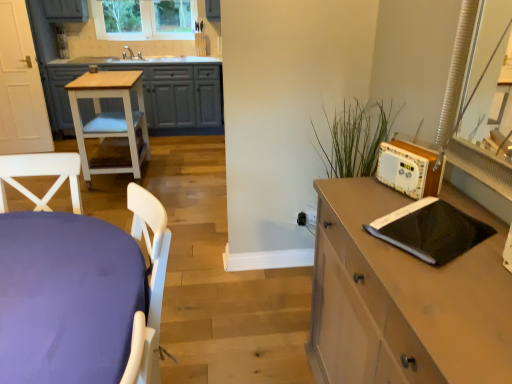
You are a GUI agent. You are given a task and a screenshot of the screen. Output one action in this format:
    pyautogui.click(x=<x>, y=<y>)
    Task: Click on the vacant area on top of matte brown cabinet at right (from a real-world perspective)
    The image size is (512, 384).
    Given the screenshot: What is the action you would take?
    pyautogui.click(x=424, y=245)